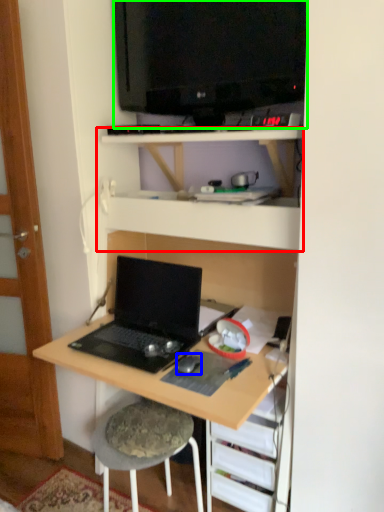
Question: Considering the real-world distances, which object is farthest from shelf (highlighted by a red box)? mouse (highlighted by a blue box) or television (highlighted by a green box)?

Choices:
 (A) mouse
 (B) television

Answer: (A)